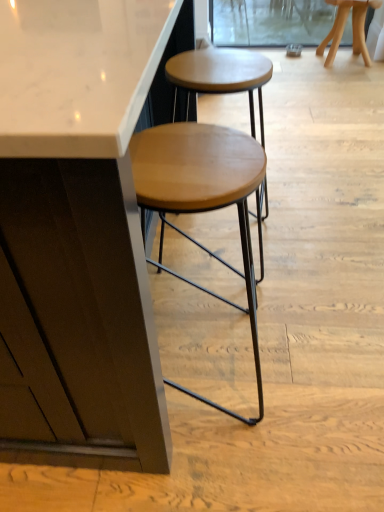
What are the coordinates of `vacant area that lies to the right of wooden seat at center, the first stool ordered from the bottom` in the screenshot? It's located at (306, 357).